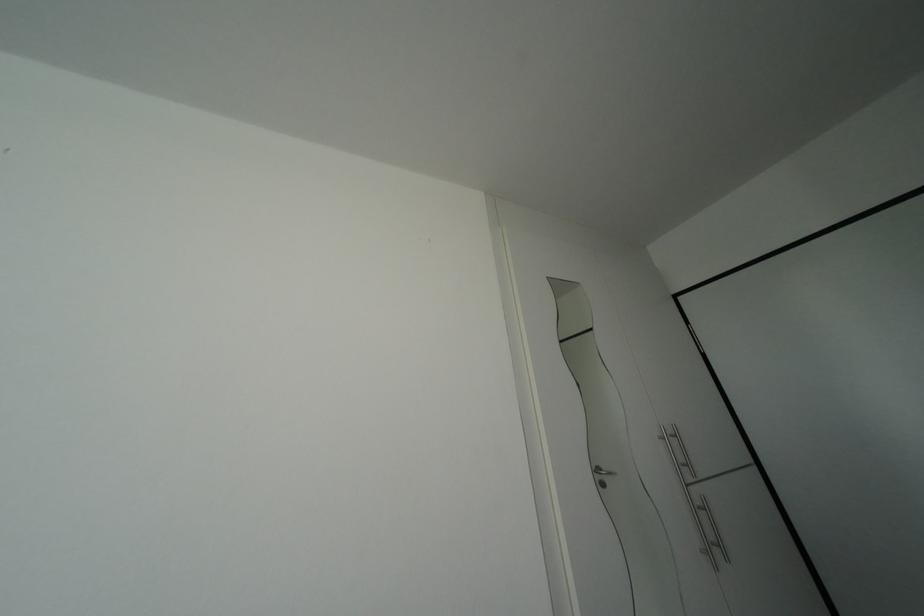
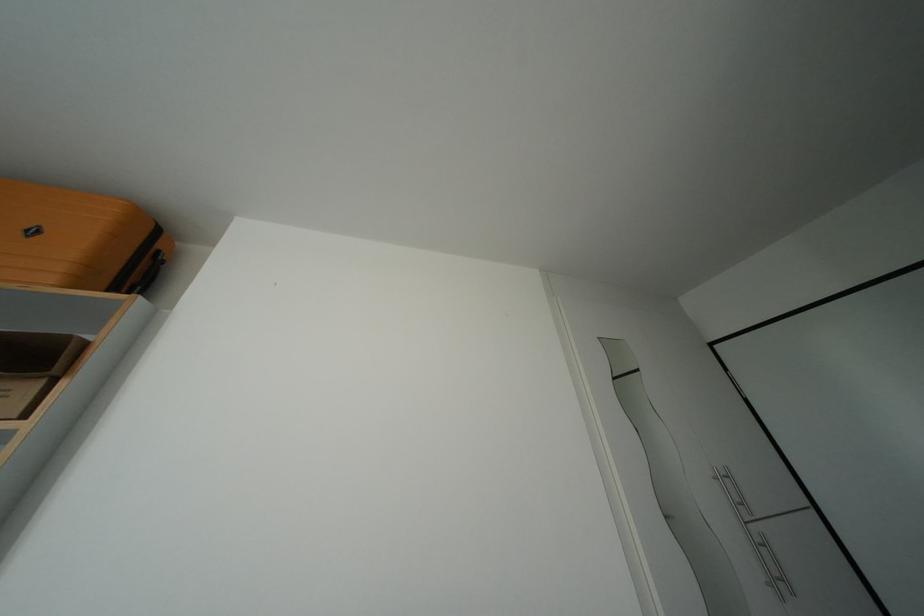
The point at (x=723, y=552) is marked in the first image. Where is the corresponding point in the second image?

(787, 586)